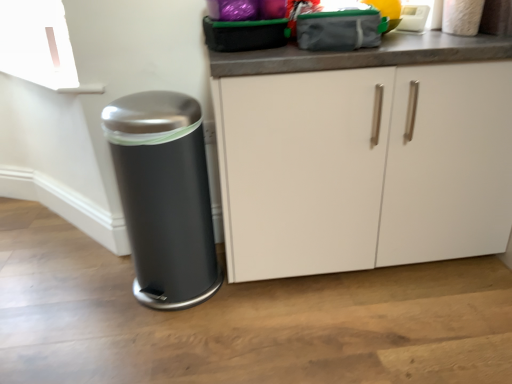
Measure the distance between point (400,106) and camera.

The depth of point (400,106) is 1.26 meters.

Measure the distance between white matte cabinet at center and camera.

The depth of white matte cabinet at center is 1.17 meters.

What do you see at coordinates (164, 196) in the screenshot? I see `satin black trash can at lower left` at bounding box center [164, 196].

Describe the element at coordinates (413, 18) in the screenshot. The height and width of the screenshot is (384, 512). I see `white plastic appliance at upper right` at that location.

You are a GUI agent. You are given a task and a screenshot of the screen. Output one action in this format:
    pyautogui.click(x=<x>, y=<y>)
    Task: Click on the white plastic appliance at upper right
    
    Given the screenshot: What is the action you would take?
    pyautogui.click(x=413, y=18)

Where is `white matte cabinet at center`? white matte cabinet at center is located at coordinates (362, 168).

From the image's perspective, which is above, white matte cabinet at center or satin black trash can at lower left?

white matte cabinet at center is shown above in the image.

In terms of width, does white matte cabinet at center look wider or thinner when compared to satin black trash can at lower left?

In the image, white matte cabinet at center appears to be wider than satin black trash can at lower left.

Is white matte cabinet at center oriented away from satin black trash can at lower left?

No, white matte cabinet at center is not facing the opposite direction of satin black trash can at lower left.

Looking at this image, is white plastic appliance at upper right positioned far away from satin black trash can at lower left?

No.

Measure the distance between white plastic appliance at upper right and satin black trash can at lower left.

white plastic appliance at upper right is 98.24 centimeters from satin black trash can at lower left.

Is white plastic appliance at upper right outside of satin black trash can at lower left?

Yes, white plastic appliance at upper right is outside of satin black trash can at lower left.

In terms of size, does white plastic appliance at upper right appear bigger or smaller than satin black trash can at lower left?

In the image, white plastic appliance at upper right appears to be smaller than satin black trash can at lower left.

Locate an element on the screen. The width and height of the screenshot is (512, 384). waste container in front of the white plastic appliance at upper right is located at coordinates (164, 196).

Considering the relative sizes of satin black trash can at lower left and white plastic appliance at upper right in the image provided, is satin black trash can at lower left thinner than white plastic appliance at upper right?

No.

Is satin black trash can at lower left with white plastic appliance at upper right?

satin black trash can at lower left is not next to white plastic appliance at upper right, and they're not touching.

From a real-world perspective, is satin black trash can at lower left above or below white plastic appliance at upper right?

Clearly, from a real-world perspective, satin black trash can at lower left is below white plastic appliance at upper right.

Is white matte cabinet at center outside of white plastic appliance at upper right?

white matte cabinet at center lies outside white plastic appliance at upper right's area.

Is white matte cabinet at center looking in the opposite direction of white plastic appliance at upper right?

white matte cabinet at center does not have its back to white plastic appliance at upper right.

Considering the relative sizes of white matte cabinet at center and white plastic appliance at upper right in the image provided, is white matte cabinet at center smaller than white plastic appliance at upper right?

No.

Can you confirm if white matte cabinet at center is positioned to the left of white plastic appliance at upper right?

Yes, white matte cabinet at center is to the left of white plastic appliance at upper right.

Is white plastic appliance at upper right further to camera compared to white matte cabinet at center?

Yes, it is behind white matte cabinet at center.

From a real-world perspective, which is physically above, white plastic appliance at upper right or white matte cabinet at center?

white plastic appliance at upper right, from a real-world perspective.

Is white matte cabinet at center inside white plastic appliance at upper right?

No, white matte cabinet at center is not surrounded by white plastic appliance at upper right.

Is satin black trash can at lower left directly adjacent to white matte cabinet at center?

No, satin black trash can at lower left is not next to white matte cabinet at center.

At what (x,y) coordinates should I click in order to perform the action: click on waste container below the white matte cabinet at center (from a real-world perspective). Please return your answer as a coordinate pair (x, y). The image size is (512, 384). Looking at the image, I should click on (164, 196).

Looking at this image, which point is more distant from viewer, (177, 128) or (402, 193)?

The point (402, 193) is farther.

Is satin black trash can at lower left surrounding white matte cabinet at center?

No, white matte cabinet at center is not inside satin black trash can at lower left.

Find the location of `cabinetry above the satin black trash can at lower left (from the image's perspective)`. cabinetry above the satin black trash can at lower left (from the image's perspective) is located at coordinates (362, 168).

I want to click on appliance behind the satin black trash can at lower left, so click(x=413, y=18).

From the image, which object appears to be nearer to white matte cabinet at center, white plastic appliance at upper right or satin black trash can at lower left?

satin black trash can at lower left.

Which object lies nearer to the anchor point satin black trash can at lower left, white plastic appliance at upper right or white matte cabinet at center?

Based on the image, white matte cabinet at center appears to be nearer to satin black trash can at lower left.

Based on their spatial positions, is satin black trash can at lower left or white matte cabinet at center closer to white plastic appliance at upper right?

white matte cabinet at center.

Based on their spatial positions, is satin black trash can at lower left or white plastic appliance at upper right closer to white matte cabinet at center?

Among the two, satin black trash can at lower left is located nearer to white matte cabinet at center.

Looking at the image, which one is located closer to satin black trash can at lower left, white matte cabinet at center or white plastic appliance at upper right?

white matte cabinet at center lies closer to satin black trash can at lower left than the other object.

Based on their spatial positions, is white matte cabinet at center or satin black trash can at lower left closer to white plastic appliance at upper right?

white matte cabinet at center lies closer to white plastic appliance at upper right than the other object.

Locate an element on the screen. This screenshot has width=512, height=384. cabinetry between satin black trash can at lower left and white plastic appliance at upper right from left to right is located at coordinates (362, 168).